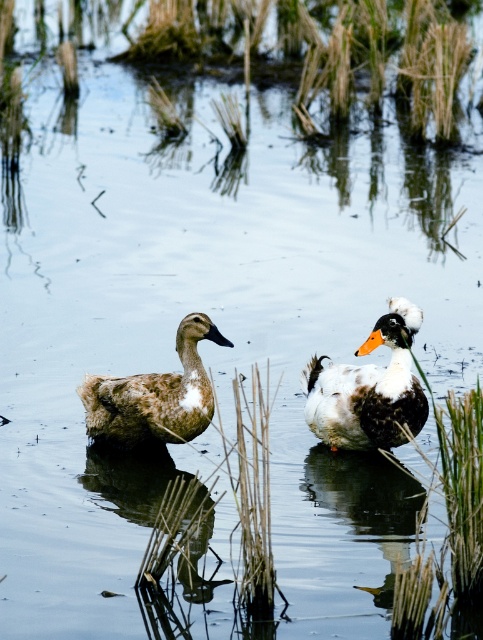
Question: Does white fluffy duck at center have a greater width compared to brown fuzzy duck at left?

Choices:
 (A) no
 (B) yes

Answer: (A)

Question: Which point appears closest to the camera in this image?

Choices:
 (A) (317, 435)
 (B) (328, 13)
 (C) (119, 392)

Answer: (C)

Question: Among these points, which one is nearest to the camera?

Choices:
 (A) (162, 401)
 (B) (96, 12)

Answer: (A)

Question: Which point is closer to the camera?

Choices:
 (A) white fluffy duck at center
 (B) brown fuzzy duck at left
 (C) brown grass at center

Answer: (A)

Question: Can you confirm if white fluffy duck at center is smaller than brown fuzzy duck at left?

Choices:
 (A) yes
 (B) no

Answer: (B)

Question: Is brown grass at center behind white fluffy duck at center?

Choices:
 (A) no
 (B) yes

Answer: (B)